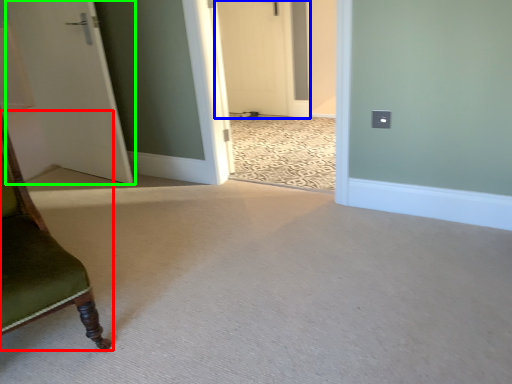
Question: Which is nearer to the furniture (highlighted by a red box)? door (highlighted by a blue box) or door (highlighted by a green box).

Choices:
 (A) door
 (B) door

Answer: (B)